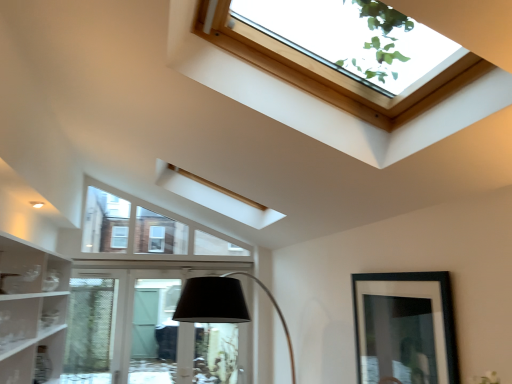
The width and height of the screenshot is (512, 384). What do you see at coordinates (333, 73) in the screenshot? I see `wooden frame skylight at upper center` at bounding box center [333, 73].

The width and height of the screenshot is (512, 384). Describe the element at coordinates (143, 333) in the screenshot. I see `clear glass door at lower center` at that location.

Locate an element on the screen. The height and width of the screenshot is (384, 512). wooden frame skylight at upper center is located at coordinates (333, 73).

Is clear glass door at lower center in contact with black matte picture frame at lower right?

clear glass door at lower center is not next to black matte picture frame at lower right, and they're not touching.

Between clear glass door at lower center and black matte picture frame at lower right, which one appears on the left side from the viewer's perspective?

clear glass door at lower center is more to the left.

Does clear glass door at lower center have a smaller size compared to black matte picture frame at lower right?

No, clear glass door at lower center is not smaller than black matte picture frame at lower right.

From a real-world perspective, is clear glass door at lower center physically located above or below black matte picture frame at lower right?

From a real-world perspective, clear glass door at lower center is physically below black matte picture frame at lower right.

Which point is more distant from viewer, [329,97] or [373,315]?

Positioned behind is point [373,315].

Considering the relative sizes of wooden frame skylight at upper center and black matte picture frame at lower right in the image provided, is wooden frame skylight at upper center bigger than black matte picture frame at lower right?

Yes, wooden frame skylight at upper center is bigger than black matte picture frame at lower right.

Is wooden frame skylight at upper center surrounding black matte picture frame at lower right?

No.

How much distance is there between wooden frame skylight at upper center and black matte picture frame at lower right?

wooden frame skylight at upper center and black matte picture frame at lower right are 37.28 inches apart.

From the image's perspective, which is below, clear glass door at lower center or wooden frame skylight at upper center?

clear glass door at lower center appears lower in the image.

Considering the sizes of clear glass door at lower center and wooden frame skylight at upper center in the image, is clear glass door at lower center bigger or smaller than wooden frame skylight at upper center?

In the image, clear glass door at lower center appears to be smaller than wooden frame skylight at upper center.

Is clear glass door at lower center inside or outside of wooden frame skylight at upper center?

clear glass door at lower center is located beyond the bounds of wooden frame skylight at upper center.

Consider the image. Based on their positions, is black matte picture frame at lower right located to the left or right of wooden frame skylight at upper center?

black matte picture frame at lower right is positioned on wooden frame skylight at upper center's right side.

You are a GUI agent. You are given a task and a screenshot of the screen. Output one action in this format:
    pyautogui.click(x=<x>, y=<y>)
    Task: Click on the window that appears above the black matte picture frame at lower right (from the image's perspective)
    The image size is (512, 384).
    Given the screenshot: What is the action you would take?
    pyautogui.click(x=333, y=73)

Looking at their sizes, would you say black matte picture frame at lower right is wider or thinner than wooden frame skylight at upper center?

black matte picture frame at lower right is thinner than wooden frame skylight at upper center.

Is the surface of black matte picture frame at lower right in direct contact with wooden frame skylight at upper center?

No, black matte picture frame at lower right is not in contact with wooden frame skylight at upper center.

From a real-world perspective, does black matte picture frame at lower right stand above clear glass door at lower center?

Yes, from a real-world perspective, black matte picture frame at lower right is on top of clear glass door at lower center.

Looking at their sizes, would you say black matte picture frame at lower right is wider or thinner than clear glass door at lower center?

black matte picture frame at lower right is thinner than clear glass door at lower center.

Is the surface of black matte picture frame at lower right in direct contact with clear glass door at lower center?

No, black matte picture frame at lower right is not with clear glass door at lower center.

Is black matte picture frame at lower right outside of clear glass door at lower center?

Indeed, black matte picture frame at lower right is completely outside clear glass door at lower center.

Where is `glass door that appears on the left of wooden frame skylight at upper center`? The width and height of the screenshot is (512, 384). glass door that appears on the left of wooden frame skylight at upper center is located at coordinates (143, 333).

Looking at this image, in the image, is wooden frame skylight at upper center positioned in front of or behind clear glass door at lower center?

wooden frame skylight at upper center is positioned closer to the viewer than clear glass door at lower center.

Is wooden frame skylight at upper center oriented away from clear glass door at lower center?

That's not correct — wooden frame skylight at upper center is not looking away from clear glass door at lower center.

Looking at this image, is wooden frame skylight at upper center smaller than clear glass door at lower center?

Incorrect, wooden frame skylight at upper center is not smaller in size than clear glass door at lower center.

This screenshot has width=512, height=384. In order to click on glass door to the left of black matte picture frame at lower right in this screenshot , I will do `click(143, 333)`.

Find the location of a particular element. picture frame below the wooden frame skylight at upper center (from the image's perspective) is located at coordinates (405, 328).

When comparing their distances from black matte picture frame at lower right, does wooden frame skylight at upper center or clear glass door at lower center seem closer?

wooden frame skylight at upper center is closer to black matte picture frame at lower right.

When comparing their distances from wooden frame skylight at upper center, does black matte picture frame at lower right or clear glass door at lower center seem further?

clear glass door at lower center lies further to wooden frame skylight at upper center than the other object.

Which object lies nearer to the anchor point clear glass door at lower center, black matte picture frame at lower right or wooden frame skylight at upper center?

Based on the image, black matte picture frame at lower right appears to be nearer to clear glass door at lower center.

Which object lies nearer to the anchor point black matte picture frame at lower right, clear glass door at lower center or wooden frame skylight at upper center?

Based on the image, wooden frame skylight at upper center appears to be nearer to black matte picture frame at lower right.

Estimate the real-world distances between objects in this image. Which object is closer to wooden frame skylight at upper center, clear glass door at lower center or black matte picture frame at lower right?

black matte picture frame at lower right is positioned closer to the anchor wooden frame skylight at upper center.

When comparing their distances from clear glass door at lower center, does wooden frame skylight at upper center or black matte picture frame at lower right seem closer?

The object closer to clear glass door at lower center is black matte picture frame at lower right.

Identify the location of picture frame between wooden frame skylight at upper center and clear glass door at lower center in the front-back direction. This screenshot has height=384, width=512. (405, 328).